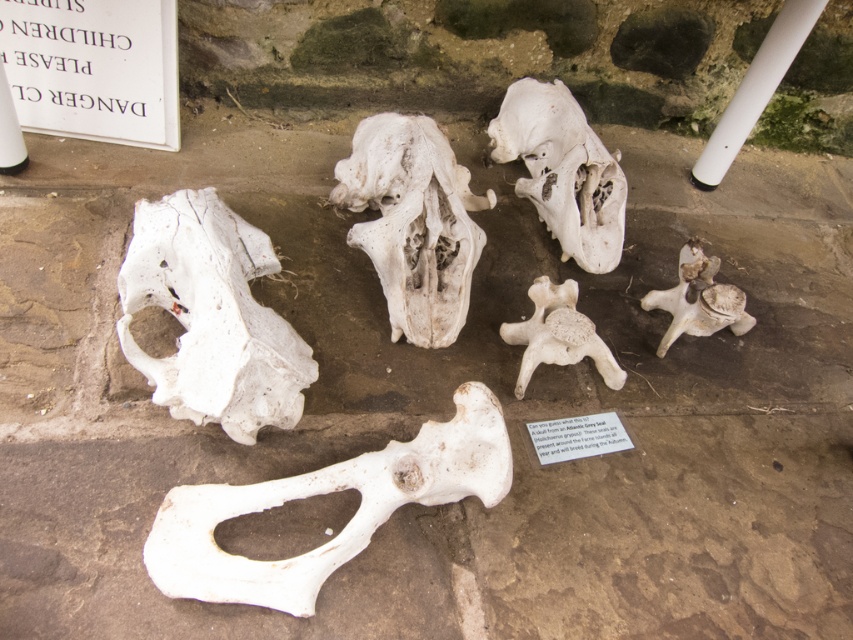
Question: Which of these objects is positioned farthest from the white porous bone at center?

Choices:
 (A) white bone at center
 (B) white porous skull at upper center
 (C) white matte skull at left

Answer: (A)

Question: Is the position of white bone at center more distant than that of white porous bone at center?

Choices:
 (A) no
 (B) yes

Answer: (A)

Question: Can you confirm if white matte skull at left is bigger than white porous bone at center?

Choices:
 (A) no
 (B) yes

Answer: (A)

Question: Does white matte skull at left come behind white porous skull at upper center?

Choices:
 (A) no
 (B) yes

Answer: (A)

Question: Which of the following is the closest to the observer?

Choices:
 (A) (238, 387)
 (B) (587, 138)
 (C) (430, 218)
 (D) (344, 552)

Answer: (A)

Question: Which object is positioned closest to the white porous skull at upper center?

Choices:
 (A) white porous bone at center
 (B) white matte skull at left

Answer: (A)